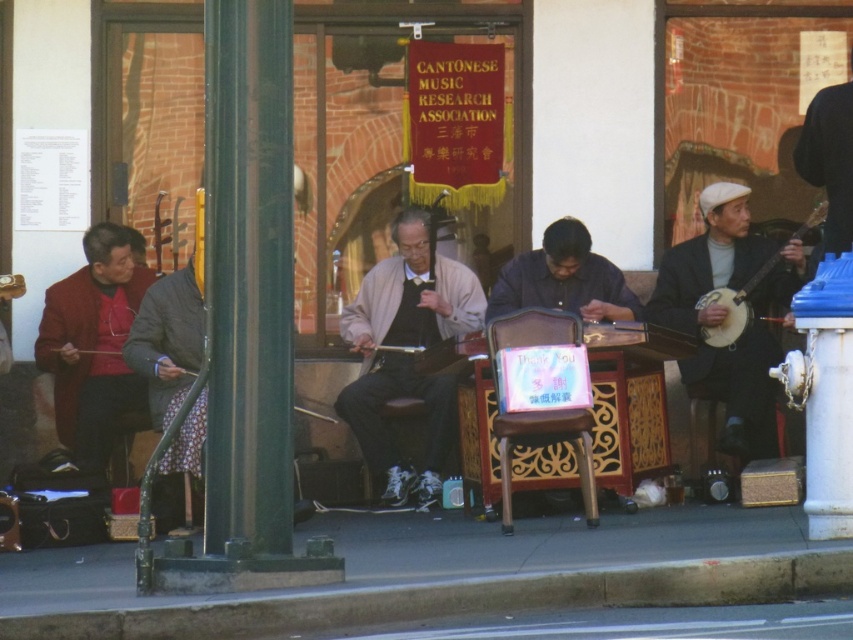
You are a street performer who needs to move your instrument case from the green polished metal pole at left to the matte gray sweater at center. Which direction should you move the case to place it closer to the sweater?

The green polished metal pole at left is to the left of the matte gray sweater at center, so you should move the case to the right to place it closer to the sweater.

You are a photographer standing at the edge of the street. You want to capture a photo that includes both the concrete at lower center and the white wooden banjo at right. Which object should you adjust your camera angle to focus on first to ensure both are in frame?

Since the concrete at lower center occupies less space than the white wooden banjo at right, you should focus on the white wooden banjo at right first to ensure both objects fit within the frame.

Based on the scene description, where is the concrete at lower center located in terms of coordinates?

The concrete at lower center is located at coordinates point [445,573].